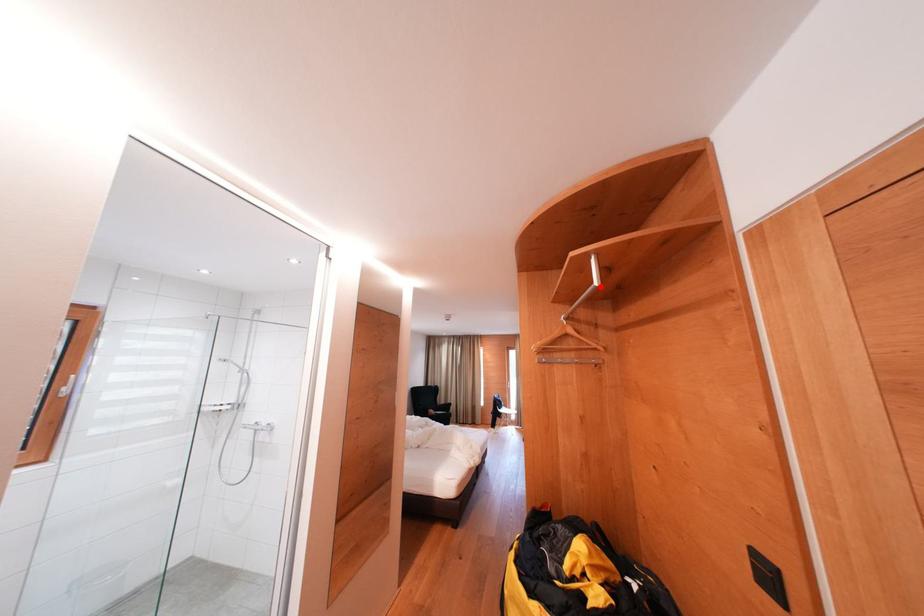
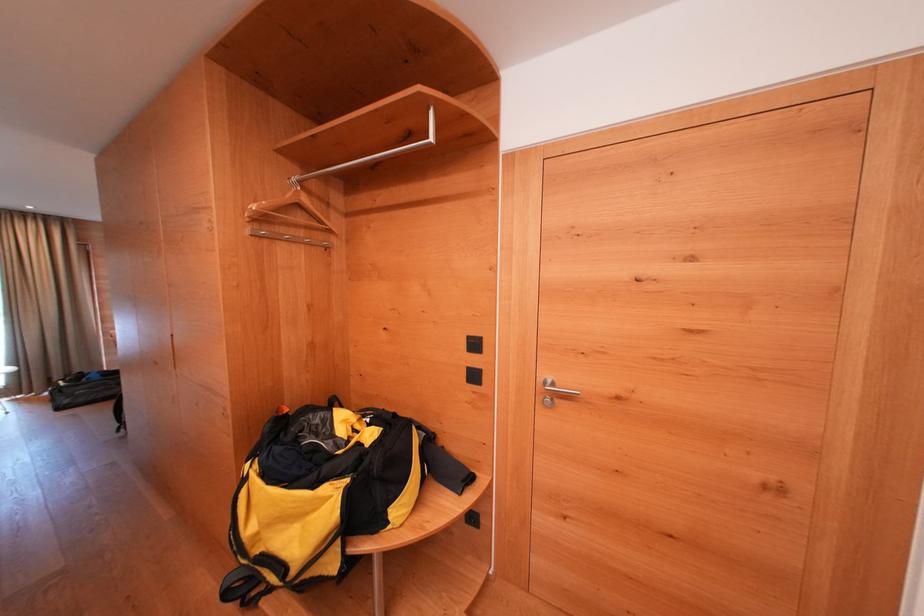
Where in the second image is the point corresponding to the highlighted location from the first image?

(434, 142)